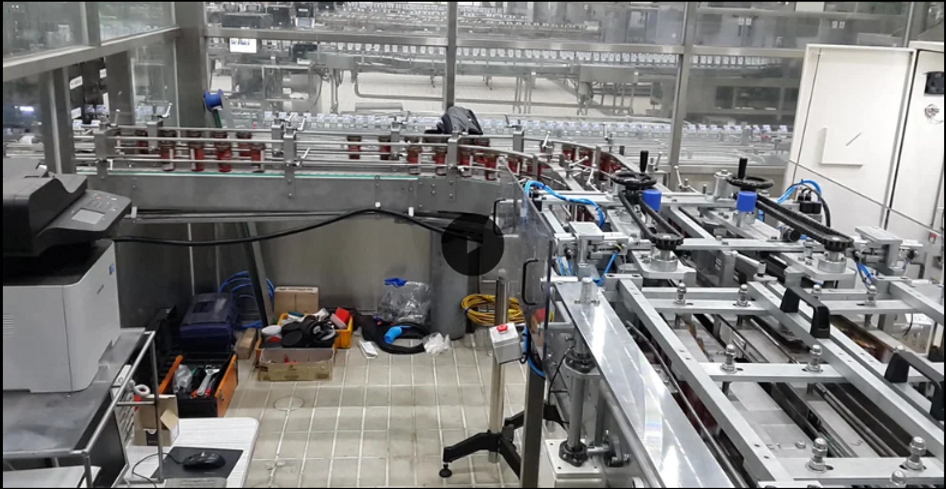
At what (x,y) coordinates should I click in order to perform the action: click on cabints. Please return your answer as a coordinate pair (x, y). Image resolution: width=946 pixels, height=489 pixels. Looking at the image, I should click on (831, 58), (911, 139).